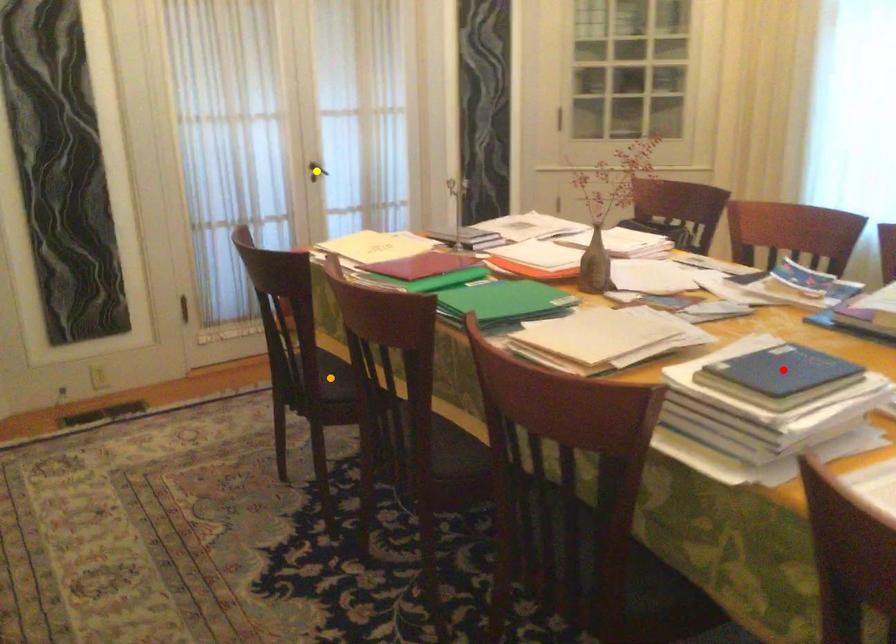
Looking at this image, order these from nearest to farthest:
A) yellow point
B) orange point
C) red point

red point, orange point, yellow point